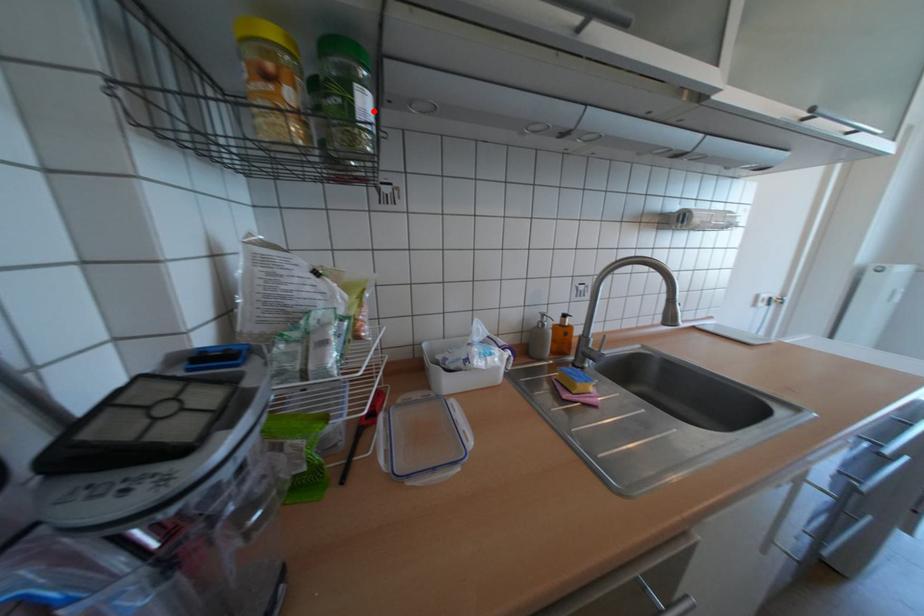
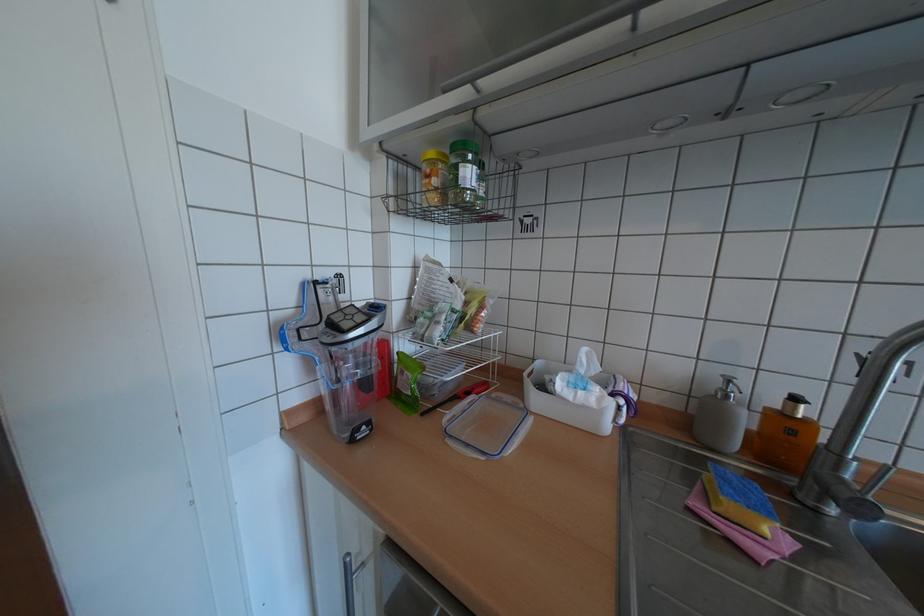
Question: I am providing you with two images of the same scene from different viewpoints. A red point is marked on the first image. Can you still see the location of the red point in image 2?

Choices:
 (A) Yes
 (B) No

Answer: (A)